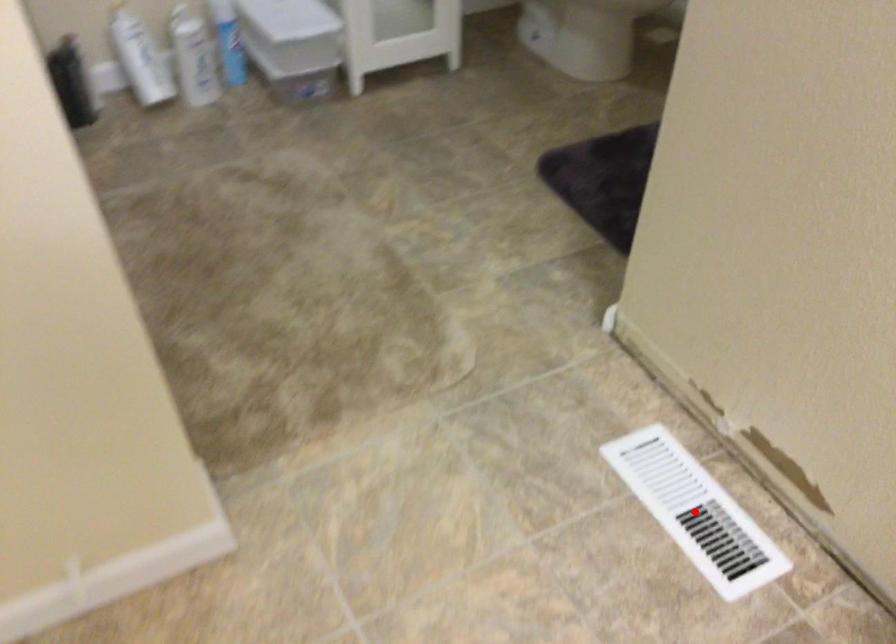
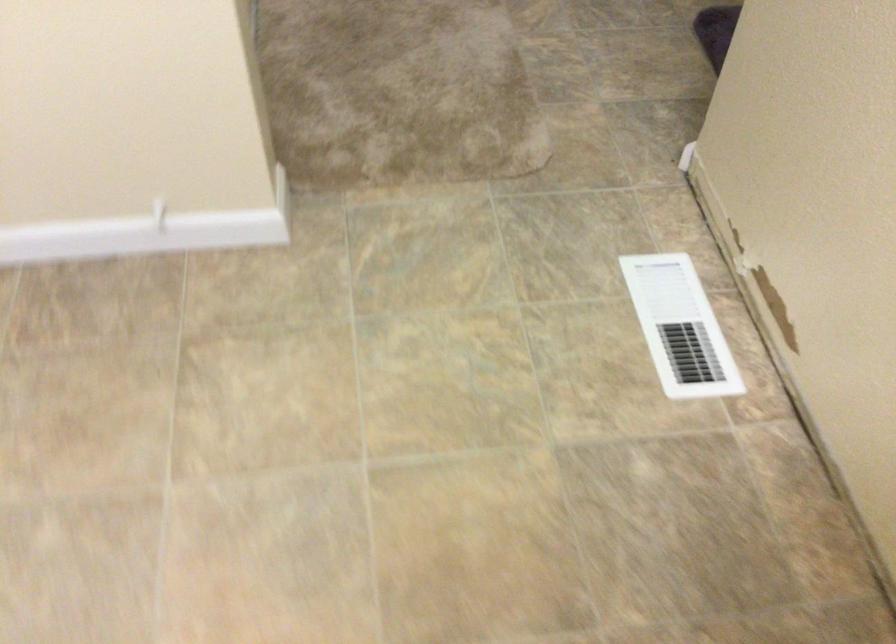
In the second image, find the point that corresponds to the highlighted location in the first image.

(679, 327)